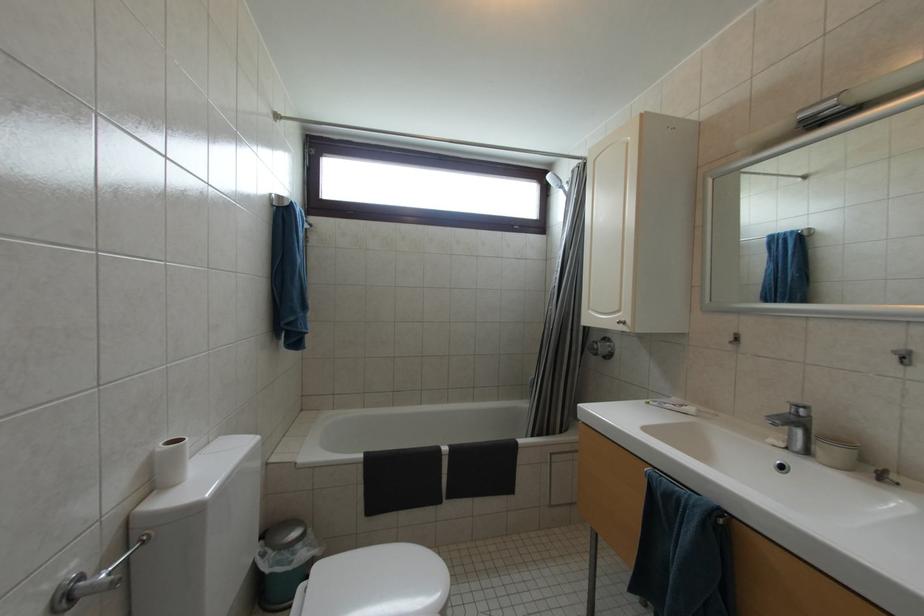
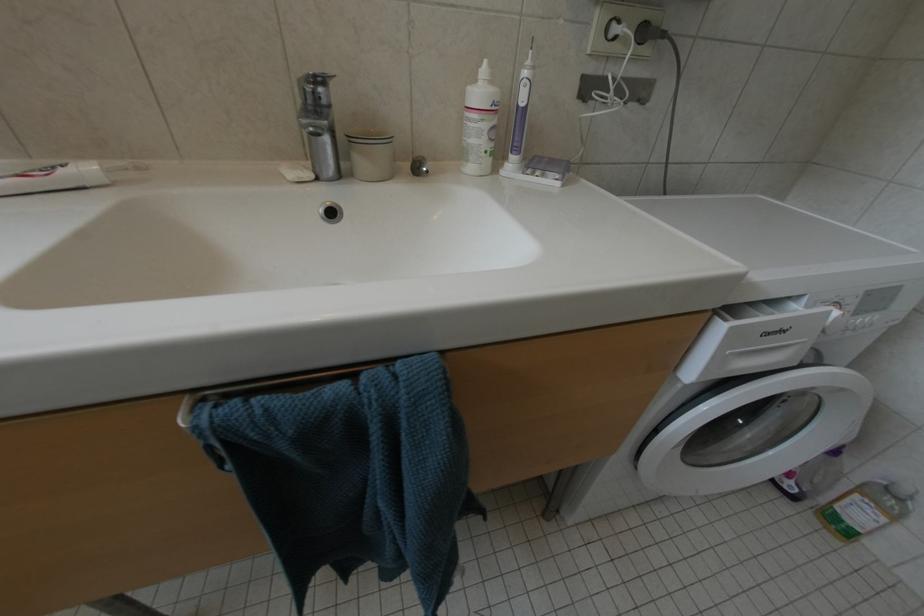
Based on the continuous images, in which direction is the camera rotating?

The camera's rotation is toward right-down.